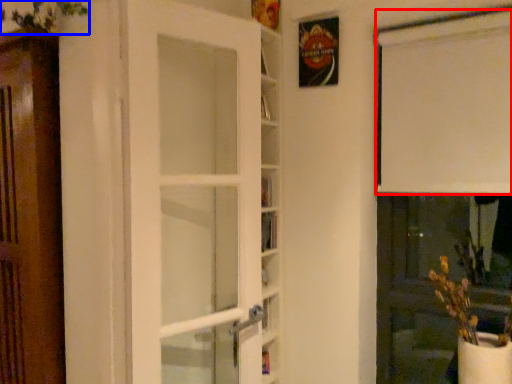
Question: Which object is closer to the camera taking this photo, curtain (highlighted by a red box) or plant (highlighted by a blue box)?

Choices:
 (A) curtain
 (B) plant

Answer: (B)